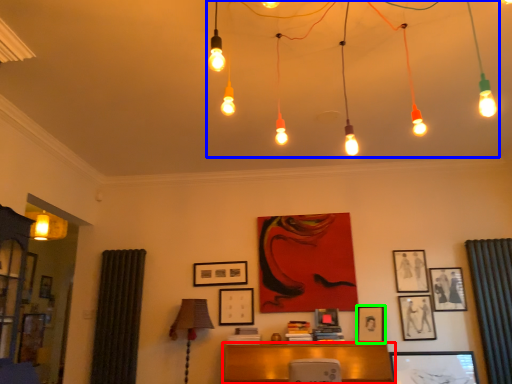
Question: Considering the real-world distances, which object is closest to furniture (highlighted by a red box)? chandelier (highlighted by a blue box) or picture frame (highlighted by a green box).

Choices:
 (A) chandelier
 (B) picture frame

Answer: (B)